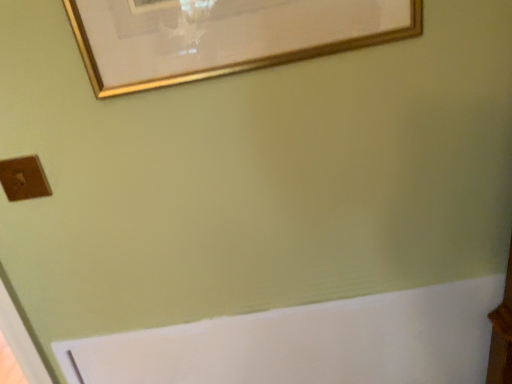
Question: Which direction should I rotate to look at gold metallic picture frame at upper center?

Choices:
 (A) right
 (B) left

Answer: (B)

Question: From the image's perspective, is brown matte/light switch at lower left under gold metallic picture frame at upper center?

Choices:
 (A) no
 (B) yes

Answer: (B)

Question: Are brown matte/light switch at lower left and gold metallic picture frame at upper center beside each other?

Choices:
 (A) yes
 (B) no

Answer: (B)

Question: From a real-world perspective, does brown matte/light switch at lower left stand above gold metallic picture frame at upper center?

Choices:
 (A) no
 (B) yes

Answer: (A)

Question: Is brown matte/light switch at lower left positioned before gold metallic picture frame at upper center?

Choices:
 (A) yes
 (B) no

Answer: (B)

Question: Is brown matte/light switch at lower left looking in the opposite direction of gold metallic picture frame at upper center?

Choices:
 (A) yes
 (B) no

Answer: (B)

Question: Could you tell me if brown matte/light switch at lower left is turned towards gold metallic picture frame at upper center?

Choices:
 (A) no
 (B) yes

Answer: (A)

Question: From the image's perspective, does gold metallic picture frame at upper center appear lower than brown matte/light switch at lower left?

Choices:
 (A) no
 (B) yes

Answer: (A)

Question: Does gold metallic picture frame at upper center appear on the left side of brown matte/light switch at lower left?

Choices:
 (A) no
 (B) yes

Answer: (A)

Question: From a real-world perspective, is gold metallic picture frame at upper center below brown matte/light switch at lower left?

Choices:
 (A) no
 (B) yes

Answer: (A)

Question: From a real-world perspective, is gold metallic picture frame at upper center located higher than brown matte/light switch at lower left?

Choices:
 (A) no
 (B) yes

Answer: (B)

Question: Is gold metallic picture frame at upper center taller than brown matte/light switch at lower left?

Choices:
 (A) no
 (B) yes

Answer: (B)

Question: Would you say gold metallic picture frame at upper center is outside brown matte/light switch at lower left?

Choices:
 (A) no
 (B) yes

Answer: (B)

Question: Is gold metallic picture frame at upper center wider or thinner than brown matte/light switch at lower left?

Choices:
 (A) wide
 (B) thin

Answer: (A)